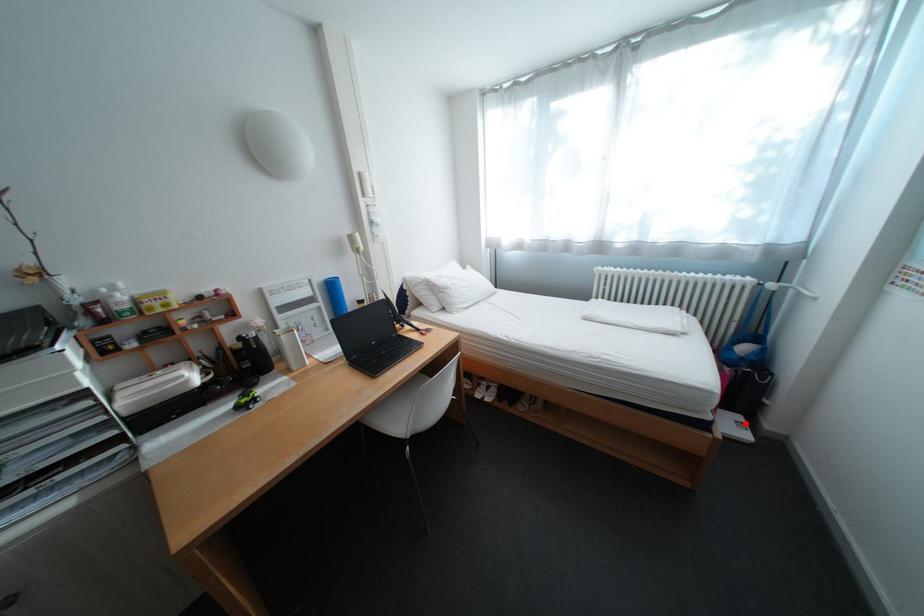
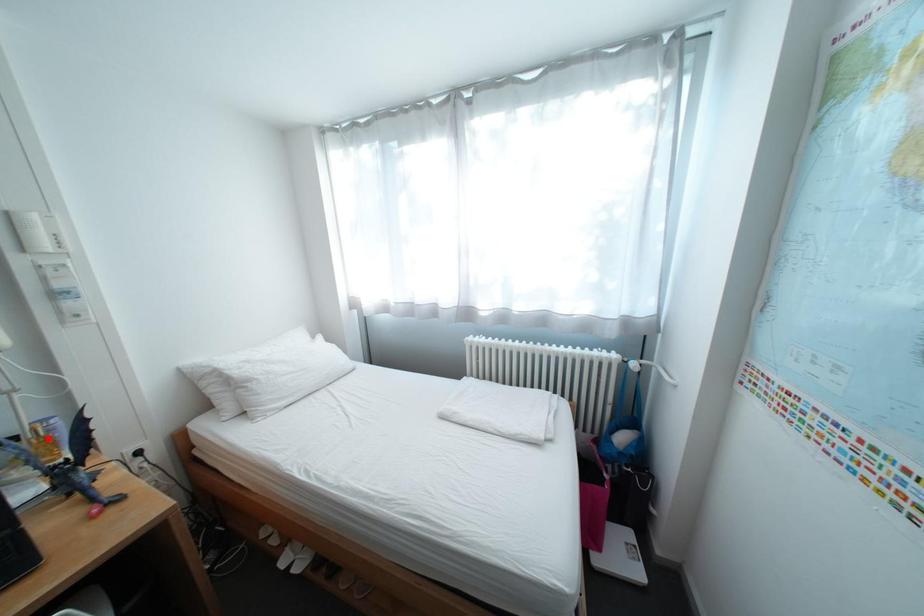
I am providing you with two images of the same scene from different viewpoints. A red point is marked on the first image and another point is marked on the second image. Does the point marked in image1 correspond to the same location as the one in image2?

No